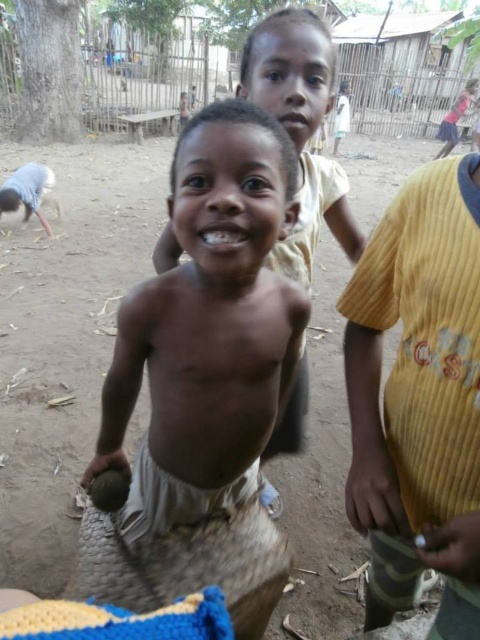
Can you confirm if yellow corduroy shirt at right is bigger than bright white teeth at center?

Yes, yellow corduroy shirt at right is bigger than bright white teeth at center.

Does yellow corduroy shirt at right appear over bright white teeth at center?

No, yellow corduroy shirt at right is not above bright white teeth at center.

Is point (447, 307) positioned behind point (235, 236)?

Yes, point (447, 307) is behind point (235, 236).

Find the location of a particular element. yellow corduroy shirt at right is located at coordinates (419, 396).

Is the position of yellow corduroy shirt at right less distant than that of pink matte mouth at upper center?

Yes.

Which is more to the right, yellow corduroy shirt at right or pink matte mouth at upper center?

yellow corduroy shirt at right is more to the right.

Is point (355, 316) farther from camera compared to point (303, 120)?

No, it is not.

Where is `yellow corduroy shirt at right`? This screenshot has height=640, width=480. yellow corduroy shirt at right is located at coordinates [419, 396].

Is the position of brown skin/soft skin child at center more distant than that of pink matte mouth at upper center?

No, it is not.

The height and width of the screenshot is (640, 480). What are the coordinates of `brown skin/soft skin child at center` in the screenshot? It's located at (301, 132).